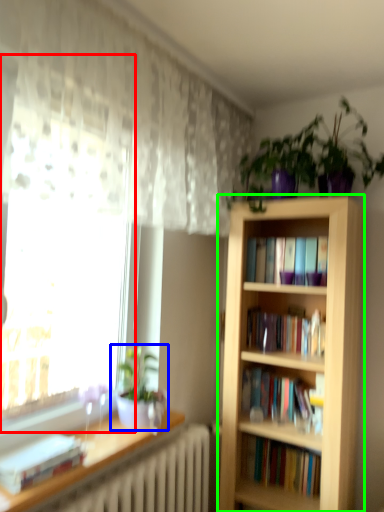
Question: Considering the real-world distances, which object is farthest from bay window (highlighted by a red box)? houseplant (highlighted by a blue box) or bookcase (highlighted by a green box)?

Choices:
 (A) houseplant
 (B) bookcase

Answer: (B)